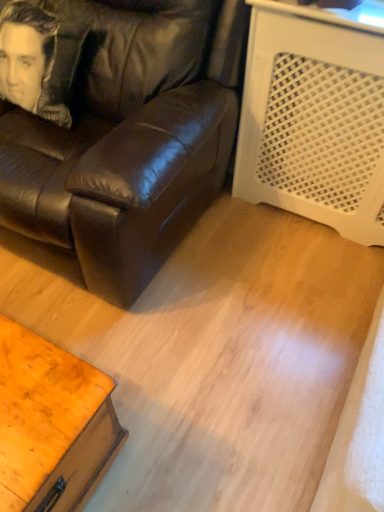
Question: Considering the positions of matte black leather couch at center and smooth leather pillow at upper left in the image, is matte black leather couch at center taller or shorter than smooth leather pillow at upper left?

Choices:
 (A) short
 (B) tall

Answer: (B)

Question: From the image's perspective, relative to smooth leather pillow at upper left, is matte black leather couch at center above or below?

Choices:
 (A) above
 (B) below

Answer: (B)

Question: Estimate the real-world distances between objects in this image. Which object is closer to the wooden table at lower left?

Choices:
 (A) matte black leather couch at center
 (B) smooth leather pillow at upper left

Answer: (A)

Question: Which object is the closest to the matte black leather couch at center?

Choices:
 (A) smooth leather pillow at upper left
 (B) wooden table at lower left

Answer: (A)